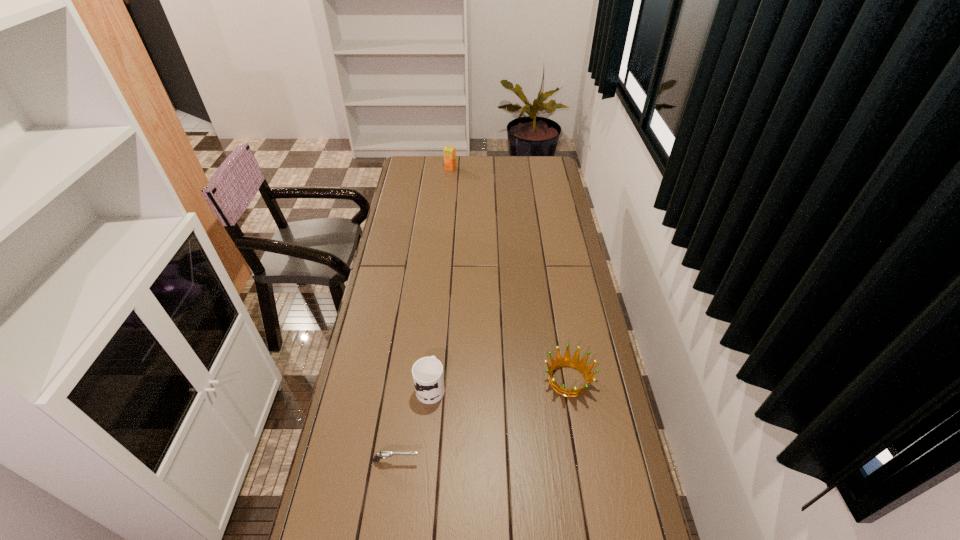
At what (x,y) coordinates should I click in order to perform the action: click on the farthest object. Please return your answer as a coordinate pair (x, y). This screenshot has height=540, width=960. Looking at the image, I should click on (449, 151).

The height and width of the screenshot is (540, 960). I want to click on mug, so click(427, 372).

This screenshot has height=540, width=960. In order to click on the rightmost object in this screenshot , I will do `click(567, 361)`.

Where is `the second shortest object`? the second shortest object is located at coordinates (567, 361).

The height and width of the screenshot is (540, 960). Find the location of `pistol`. pistol is located at coordinates (385, 454).

The width and height of the screenshot is (960, 540). I want to click on the nearest object, so click(385, 454).

At what (x,y) coordinates should I click in order to perform the action: click on vacant space located on the right of the farthest object. Please return your answer as a coordinate pair (x, y). Image resolution: width=960 pixels, height=540 pixels. Looking at the image, I should click on (470, 168).

The width and height of the screenshot is (960, 540). Identify the location of free space located on the handle side of the mug. (439, 302).

Where is `vacant area situated on the handle side of the mug`? The height and width of the screenshot is (540, 960). vacant area situated on the handle side of the mug is located at coordinates (435, 339).

This screenshot has width=960, height=540. Identify the location of free space located on the handle side of the mug. (438, 308).